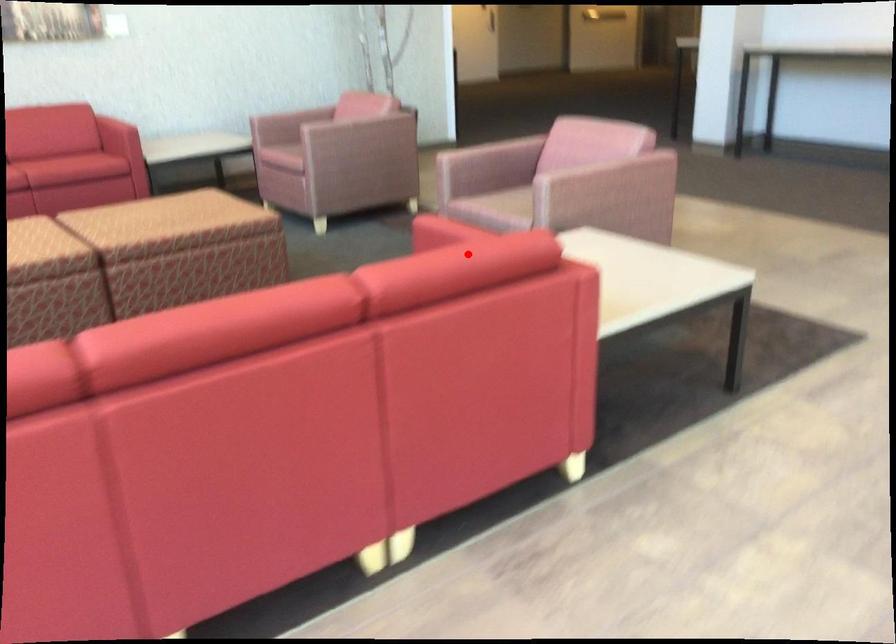
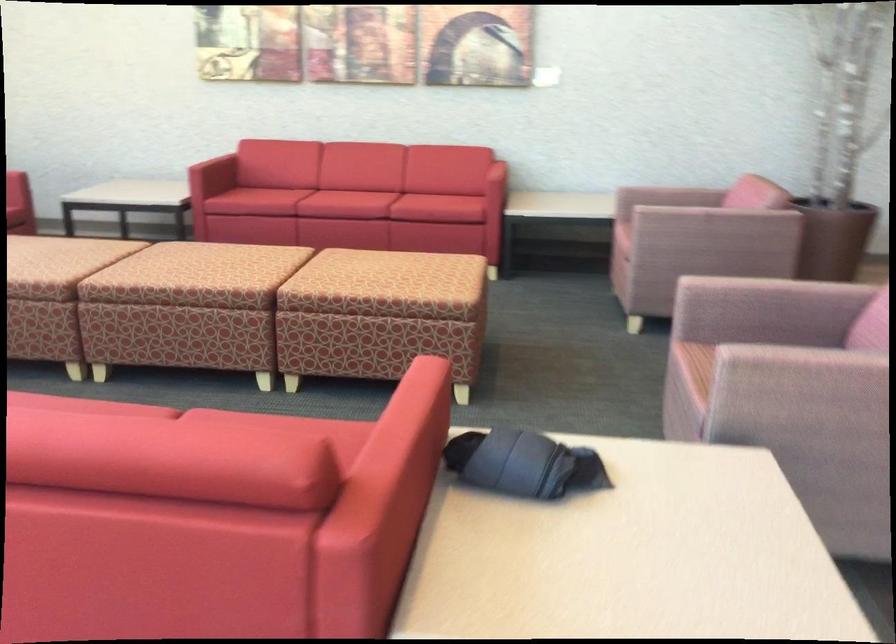
Question: A red point is marked in image1. In image2, is the corresponding 3D point closer to the camera or farther? Reply with the corresponding letter.

Choices:
 (A) The corresponding 3D point is closer.
 (B) The corresponding 3D point is farther.

Answer: (A)